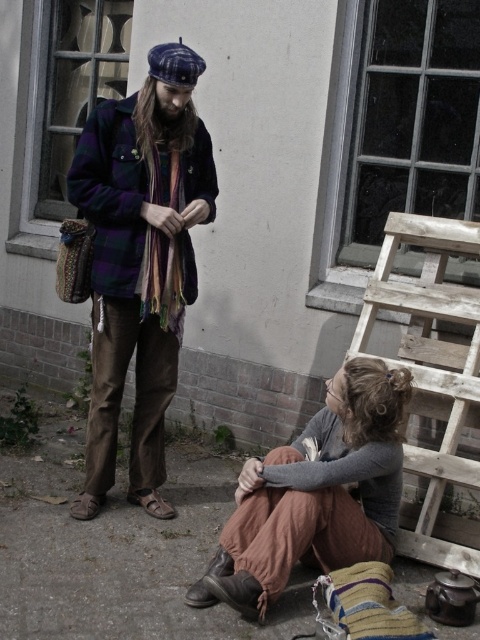
Question: Where is plaid woolen jacket at center located in relation to rustic brown pants at lower center in the image?

Choices:
 (A) below
 (B) above

Answer: (B)

Question: Which of the following is the farthest from the observer?

Choices:
 (A) plaid woolen jacket at center
 (B) rustic brown pants at lower center

Answer: (A)

Question: Observing the image, what is the correct spatial positioning of plaid woolen jacket at center in reference to rustic brown pants at lower center?

Choices:
 (A) above
 (B) below

Answer: (A)

Question: Which object appears closest to the camera in this image?

Choices:
 (A) rustic brown pants at lower center
 (B) plaid woolen jacket at center

Answer: (A)

Question: Considering the relative positions of plaid woolen jacket at center and rustic brown pants at lower center in the image provided, where is plaid woolen jacket at center located with respect to rustic brown pants at lower center?

Choices:
 (A) right
 (B) left

Answer: (B)

Question: Which point is closer to the camera?

Choices:
 (A) pos(261,596)
 (B) pos(160,451)

Answer: (A)